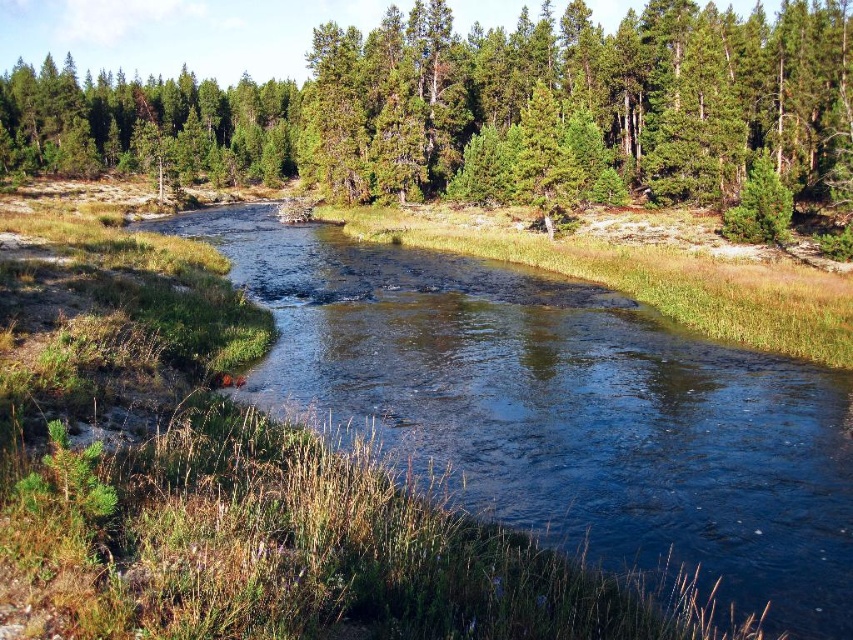
Does green textured trees at center appear under green matte tree at upper left?

Correct, green textured trees at center is located below green matte tree at upper left.

Between point (68, 93) and point (234, 116), which one is positioned behind?

The point (234, 116) is more distant.

Between point (616, 160) and point (49, 168), which one is positioned in front?

Point (616, 160) is more forward.

Find the location of a particular element. The image size is (853, 640). green textured trees at center is located at coordinates (490, 113).

Is point (495, 308) closer to camera compared to point (112, 156)?

Yes.

Consider the image. Does clear water at center have a smaller size compared to green matte tree at upper left?

Yes.

Find the location of a particular element. clear water at center is located at coordinates [x=560, y=410].

Where is `clear water at center`? This screenshot has height=640, width=853. clear water at center is located at coordinates (560, 410).

The height and width of the screenshot is (640, 853). What are the coordinates of `clear water at center` in the screenshot? It's located at (560, 410).

Between point (714, 486) and point (251, 100), which one is positioned behind?

The point (251, 100) is behind.

You are a GUI agent. You are given a task and a screenshot of the screen. Output one action in this format:
    pyautogui.click(x=<x>, y=<y>)
    Task: Click on the clear water at center
    The width and height of the screenshot is (853, 640).
    Given the screenshot: What is the action you would take?
    pyautogui.click(x=560, y=410)